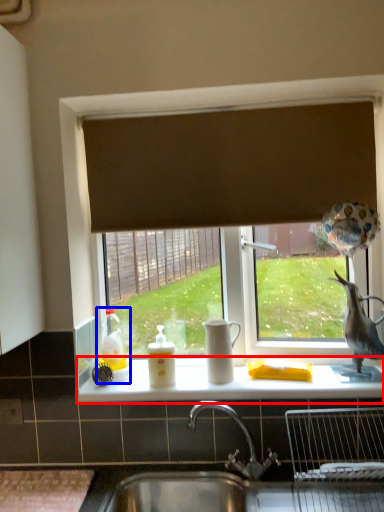
Question: Among these objects, which one is nearest to the camera, counter top (highlighted by a red box) or toy (highlighted by a blue box)?

Choices:
 (A) counter top
 (B) toy

Answer: (A)